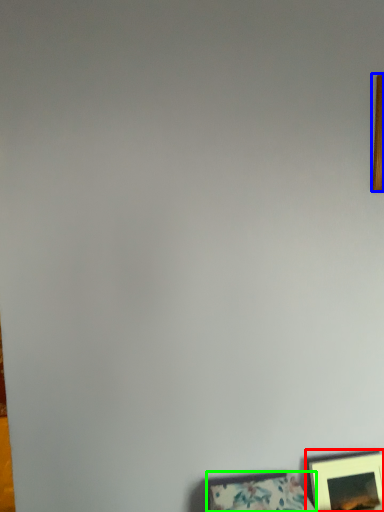
Question: Which object is positioned farthest from picture frame (highlighted by a red box)? Select from picture frame (highlighted by a blue box) and picture frame (highlighted by a green box).

Choices:
 (A) picture frame
 (B) picture frame

Answer: (A)